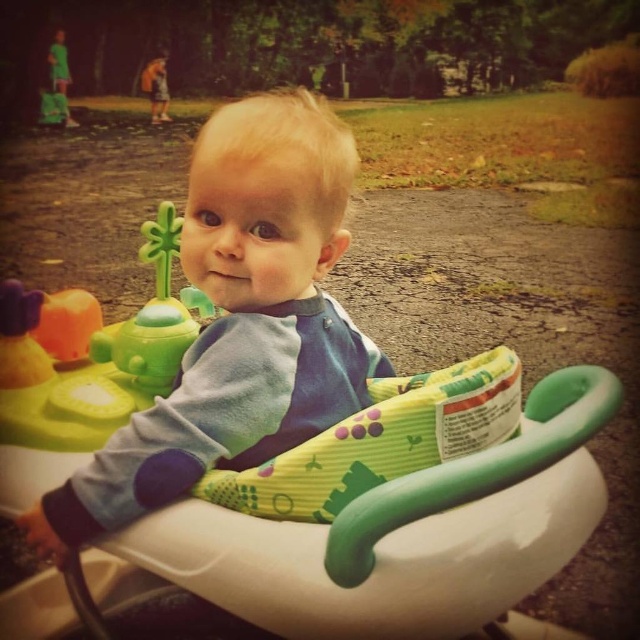
Is green plastic toy at center thinner than green plastic walker at center?

Indeed, green plastic toy at center has a lesser width compared to green plastic walker at center.

Between point (81, 403) and point (358, 548), which one is positioned in front?

Positioned in front is point (358, 548).

Measure the distance between point (170, 344) and camera.

The distance of point (170, 344) from camera is 98.95 centimeters.

The image size is (640, 640). I want to click on green plastic toy at center, so click(x=99, y=360).

Is blue soft baby at center further to camera compared to green plastic walker at center?

Yes, it is behind green plastic walker at center.

Consider the image. Does blue soft baby at center appear over green plastic walker at center?

Correct, blue soft baby at center is located above green plastic walker at center.

Which is in front, point (99, 470) or point (561, 397)?

Point (99, 470) is in front.

The height and width of the screenshot is (640, 640). I want to click on blue soft baby at center, so click(x=240, y=321).

Does blue soft baby at center have a greater width compared to green plastic toy at center?

Indeed, blue soft baby at center has a greater width compared to green plastic toy at center.

Can you confirm if blue soft baby at center is thinner than green plastic toy at center?

No.

Find the location of a particular element. This screenshot has height=640, width=640. blue soft baby at center is located at coordinates (240, 321).